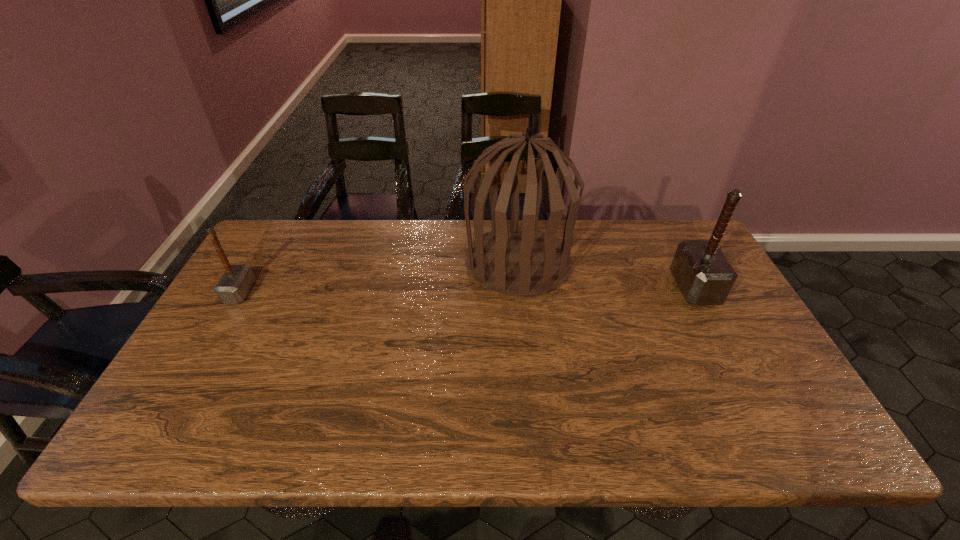
Locate which object ranks second in proximity to the left hammer. Please provide its 2D coordinates. Your answer should be formatted as a tuple, i.e. [(x, y)], where the tuple contains the x and y coordinates of a point satisfying the conditions above.

[(704, 275)]

The width and height of the screenshot is (960, 540). Identify the location of vacant region that satisfies the following two spatial constraints: 1. on the front side of the birdcage; 2. on the left side of the right hammer. (520, 288).